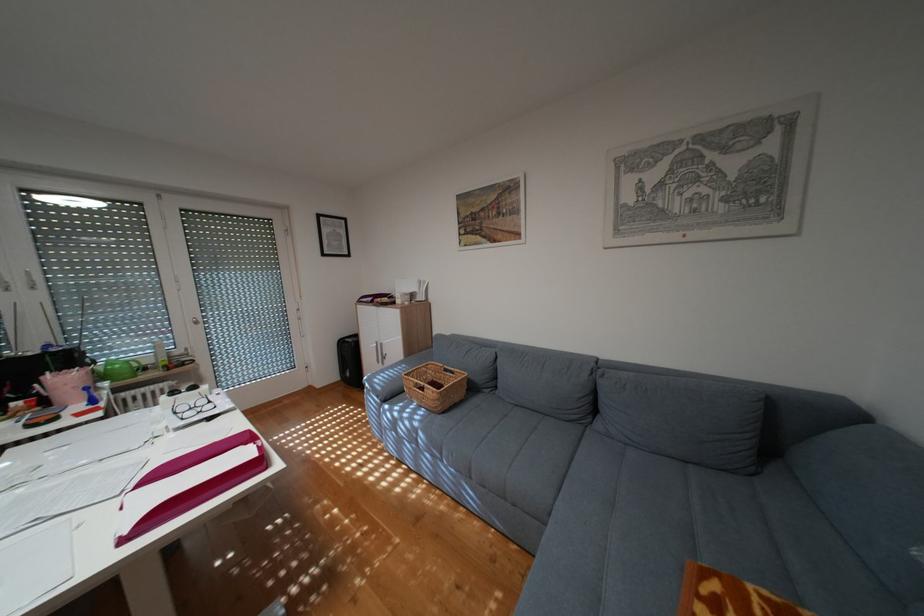
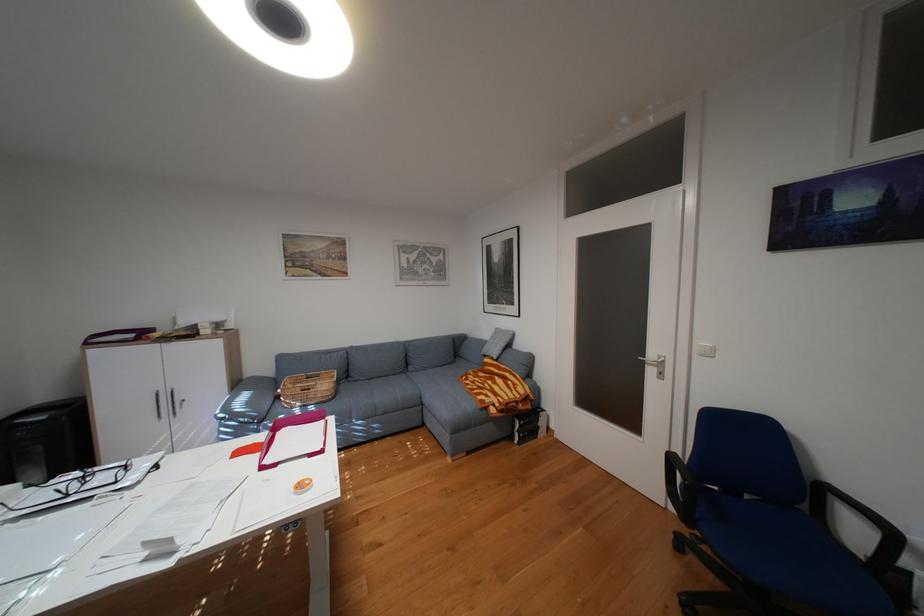
Locate, in the second image, the point that corresponds to point (465, 371) in the first image.

(331, 375)